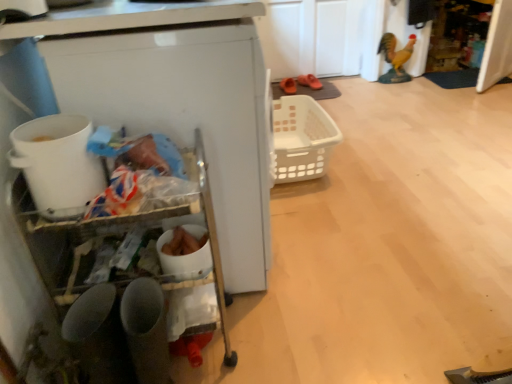
Where is `vacant space to the right of white plastic basket at center`? The height and width of the screenshot is (384, 512). vacant space to the right of white plastic basket at center is located at coordinates (385, 159).